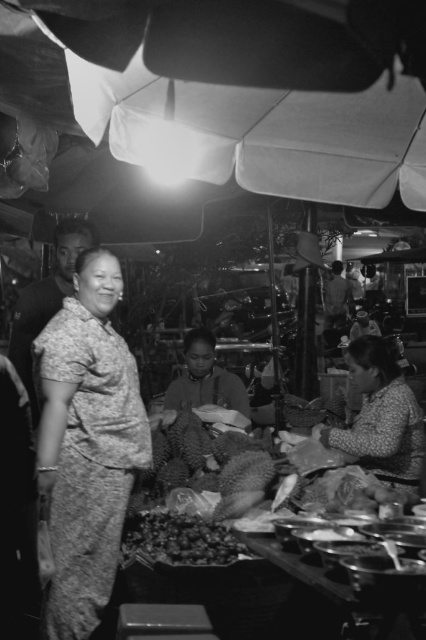
You are a photographer at the night market and want to take a photo of the two points mentioned. Which point, point (52, 589) or point (370, 355), is closer to the camera?

Point (52, 589) is in front of point (370, 355), so it is closer to the camera.